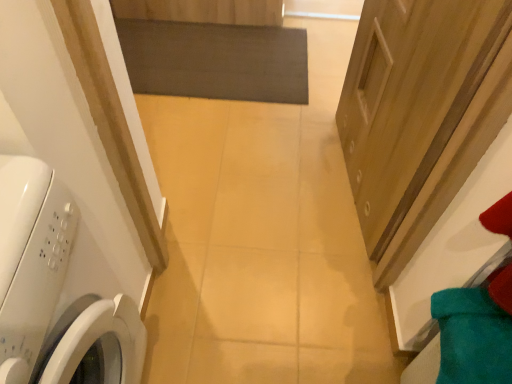
At what (x,y) coordinates should I click in order to perform the action: click on vacant space to the left of wooden door at right. Please return your answer as a coordinate pair (x, y). Looking at the image, I should click on (258, 180).